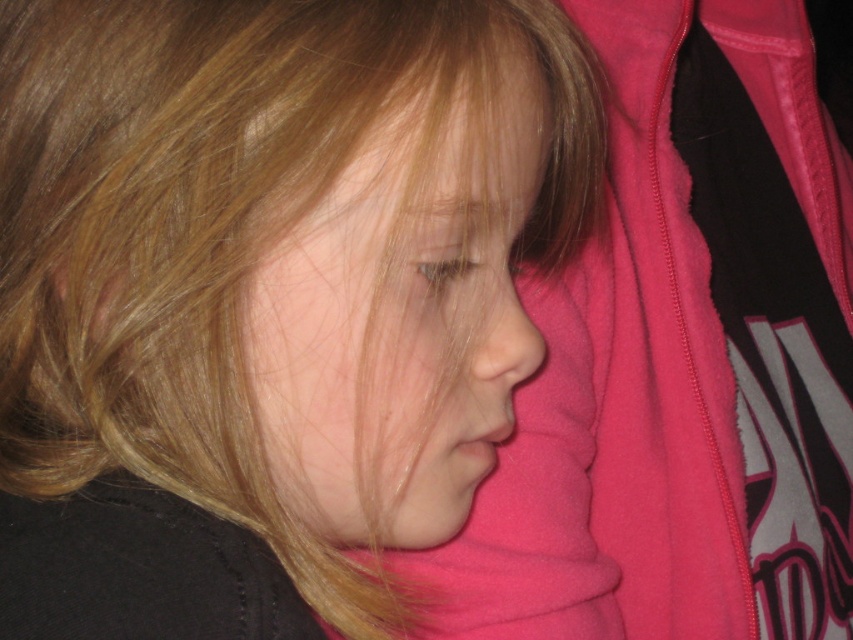
You are a photographer adjusting the focus on your camera. You want to ensure the blonde smooth hair at center is in sharp focus while the background remains blurred. Given that the hair is 10.39 inches from the viewer, what distance should your focus plane be set to?

The focus plane should be set to 10.39 inches to ensure the blonde smooth hair at center is in sharp focus.

You are a photographer adjusting the focus of your camera. The subject has a blonde smooth hair at center. Where should you adjust the focus point to ensure the hair is sharp in the final image?

The focus point should be set at the 2D location of the blonde smooth hair at center, which is at point [265,294], to ensure sharpness.